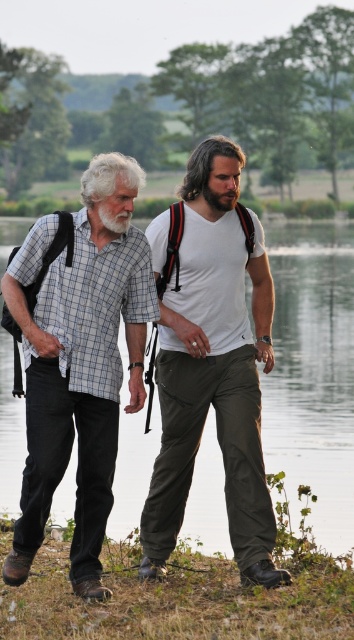
Question: Which point is farther to the camera?

Choices:
 (A) checkered fabric shirt at left
 (B) white matte t-shirt at center
 (C) brown fuzzy beard at center

Answer: (C)

Question: In this image, where is checkered fabric shirt at left located relative to white matte t-shirt at center?

Choices:
 (A) below
 (B) above

Answer: (A)

Question: Which object is closer to the camera taking this photo?

Choices:
 (A) brown fuzzy beard at center
 (B) transparent water at center
 (C) checkered fabric shirt at left
 (D) white matte t-shirt at center

Answer: (C)

Question: Is transparent water at center bigger than brown fuzzy beard at center?

Choices:
 (A) no
 (B) yes

Answer: (B)

Question: Is white matte t-shirt at center to the left of brown fuzzy beard at center from the viewer's perspective?

Choices:
 (A) yes
 (B) no

Answer: (B)

Question: Which object is farther from the camera taking this photo?

Choices:
 (A) transparent water at center
 (B) checkered fabric shirt at left

Answer: (A)